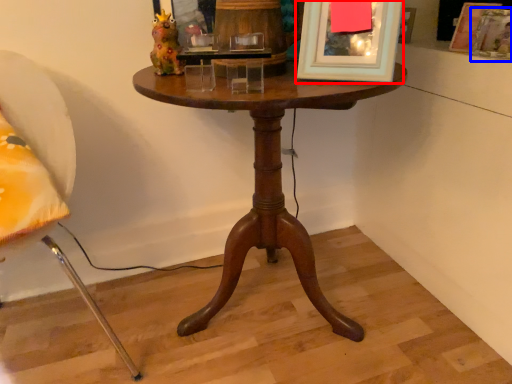
Question: Which of the following is the farthest to the observer, picture frame (highlighted by a red box) or picture frame (highlighted by a blue box)?

Choices:
 (A) picture frame
 (B) picture frame

Answer: (B)